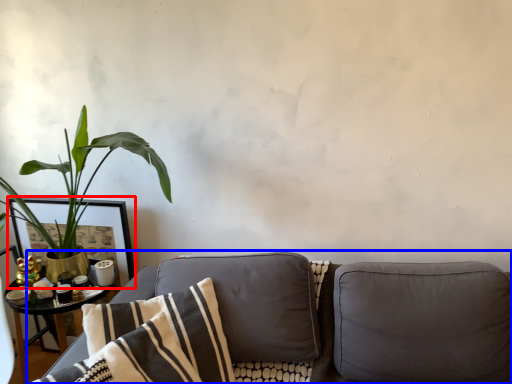
Question: Which point is further to the camera, picture frame (highlighted by a red box) or studio couch (highlighted by a blue box)?

Choices:
 (A) picture frame
 (B) studio couch

Answer: (A)